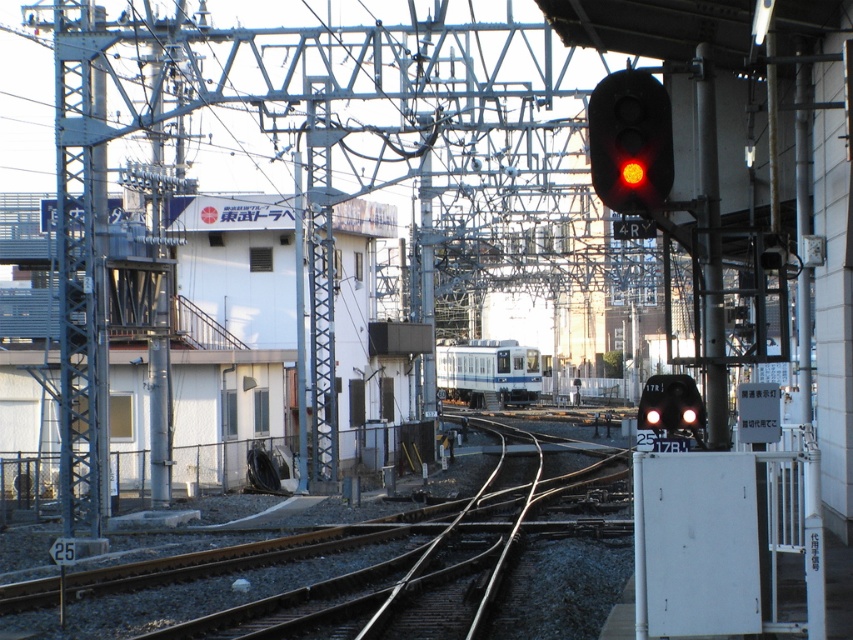
Is point (662, 92) positioned behind point (467, 356)?

No, (662, 92) is closer to viewer.

Between matte black signal light at upper right and white glossy train at center, which one appears on the left side from the viewer's perspective?

Positioned to the left is white glossy train at center.

Is point (648, 80) positioned after point (473, 392)?

That is False.

Identify the location of matte black signal light at upper right. Image resolution: width=853 pixels, height=640 pixels. (630, 141).

Does matte black signal light at upper right have a greater width compared to black glossy train at right?

In fact, matte black signal light at upper right might be narrower than black glossy train at right.

Can you confirm if matte black signal light at upper right is shorter than black glossy train at right?

In fact, matte black signal light at upper right may be taller than black glossy train at right.

Who is more distant from viewer, (660, 122) or (672, 380)?

The point (672, 380) is behind.

This screenshot has width=853, height=640. Find the location of `matte black signal light at upper right`. matte black signal light at upper right is located at coordinates (630, 141).

What do you see at coordinates (486, 371) in the screenshot?
I see `white glossy train at center` at bounding box center [486, 371].

Is white glossy train at center smaller than black glossy train at right?

No, white glossy train at center is not smaller than black glossy train at right.

The image size is (853, 640). What are the coordinates of `white glossy train at center` in the screenshot? It's located at (486, 371).

You are a GUI agent. You are given a task and a screenshot of the screen. Output one action in this format:
    pyautogui.click(x=<x>, y=<y>)
    Task: Click on the white glossy train at center
    This screenshot has height=640, width=853.
    Given the screenshot: What is the action you would take?
    pyautogui.click(x=486, y=371)